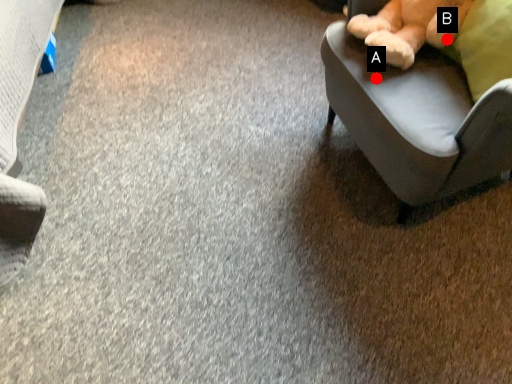
Question: Two points are circled on the image, labeled by A and B beside each circle. Which point is closer to the camera?

Choices:
 (A) A is closer
 (B) B is closer

Answer: (B)